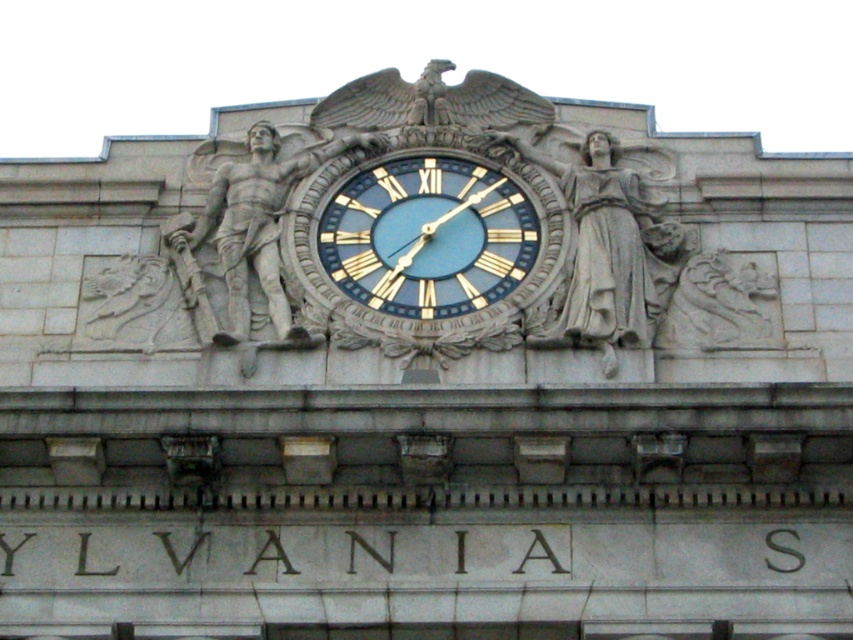
Between matte gray statue at center and stone warrior at center, which one is positioned lower?

matte gray statue at center is below.

Does point (593, 243) lie in front of point (221, 262)?

That is True.

The width and height of the screenshot is (853, 640). What are the coordinates of `matte gray statue at center` in the screenshot? It's located at (608, 250).

Between blue metallic clock at center and matte gray statue at center, which one is positioned lower?

Positioned lower is matte gray statue at center.

Where is `blue metallic clock at center`? This screenshot has width=853, height=640. blue metallic clock at center is located at coordinates (428, 236).

You are a GUI agent. You are given a task and a screenshot of the screen. Output one action in this format:
    pyautogui.click(x=<x>, y=<y>)
    Task: Click on the blue metallic clock at center
    This screenshot has height=640, width=853.
    Given the screenshot: What is the action you would take?
    pyautogui.click(x=428, y=236)

Can you confirm if blue metallic clock at center is shorter than stone warrior at center?

Yes, blue metallic clock at center is shorter than stone warrior at center.

Between point (482, 284) and point (206, 224), which one is positioned in front?

Point (482, 284)

Which is behind, point (410, 205) or point (286, 312)?

Positioned behind is point (410, 205).

This screenshot has height=640, width=853. Identify the location of blue metallic clock at center. (428, 236).